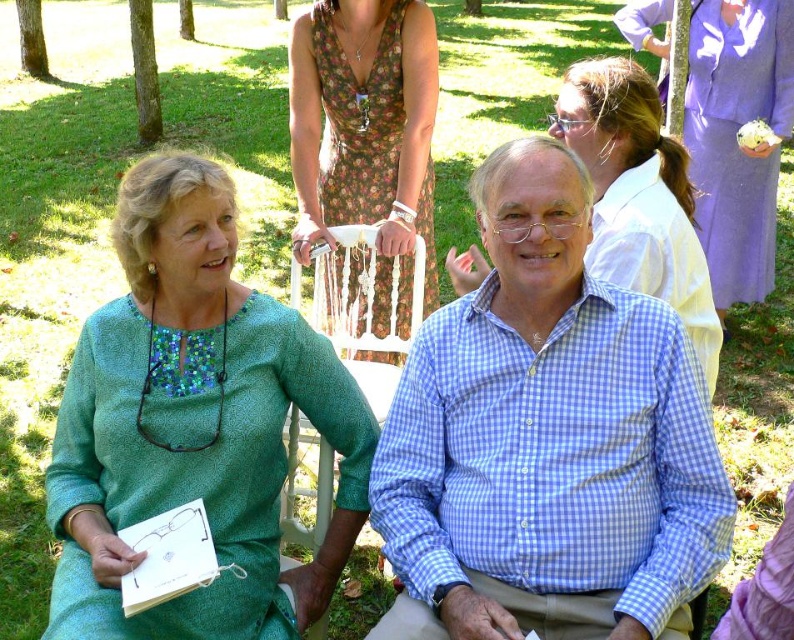
Question: Among these points, which one is farthest from the camera?

Choices:
 (A) (550, 554)
 (B) (473, 244)

Answer: (B)

Question: Is blue checkered shirt at center closer to the viewer compared to white plastic chair at center?

Choices:
 (A) no
 (B) yes

Answer: (B)

Question: Is blue checkered shirt at center further to the viewer compared to matte green dress at center?

Choices:
 (A) yes
 (B) no

Answer: (B)

Question: Can you confirm if blue checkered shirt at center is positioned to the left of lavender satin dress at upper right?

Choices:
 (A) yes
 (B) no

Answer: (A)

Question: Among these points, which one is farthest from the camera?

Choices:
 (A) (739, 10)
 (B) (295, 100)
 (C) (710, 314)

Answer: (A)

Question: Considering the real-world distances, which object is farthest from the white plastic chair at center?

Choices:
 (A) blue checkered shirt at center
 (B) floral dress at center
 (C) green textured dress at left
 (D) matte green dress at center

Answer: (A)